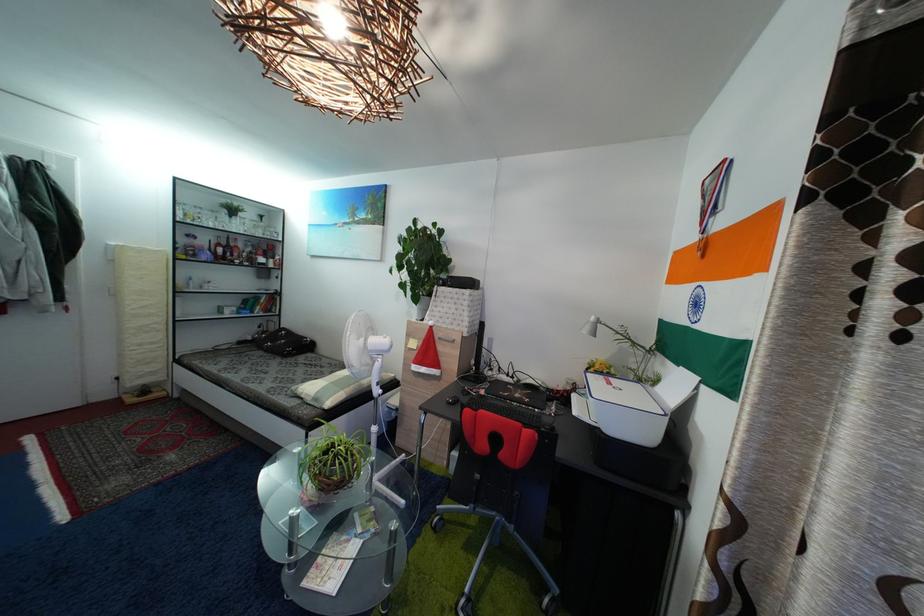
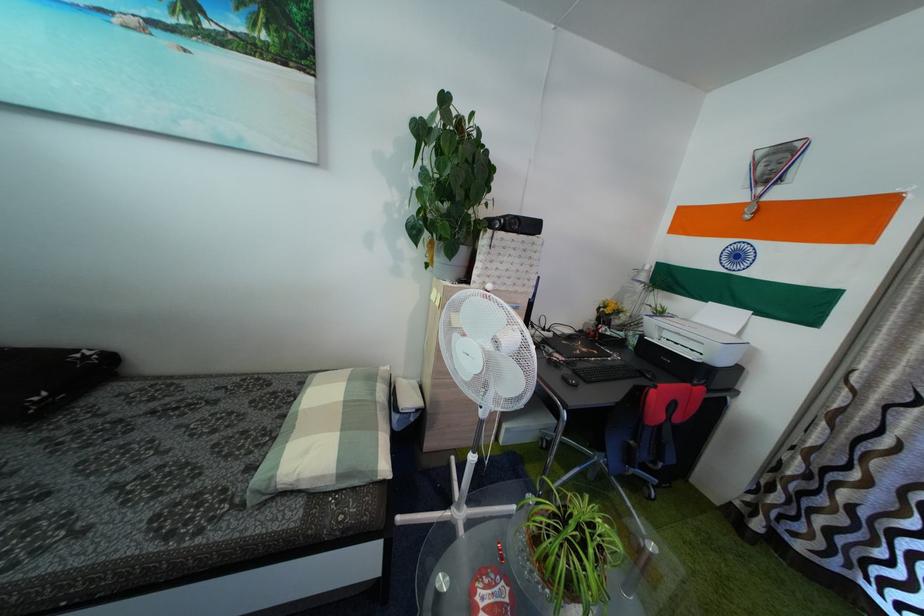
In the second image, find the point that corresponds to the point at 512,413 in the first image.

(599, 371)